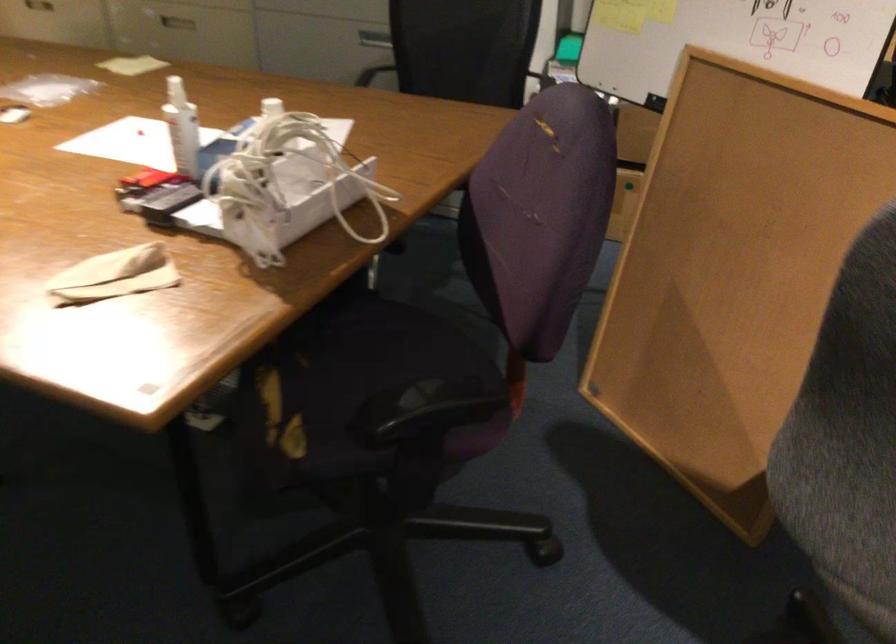
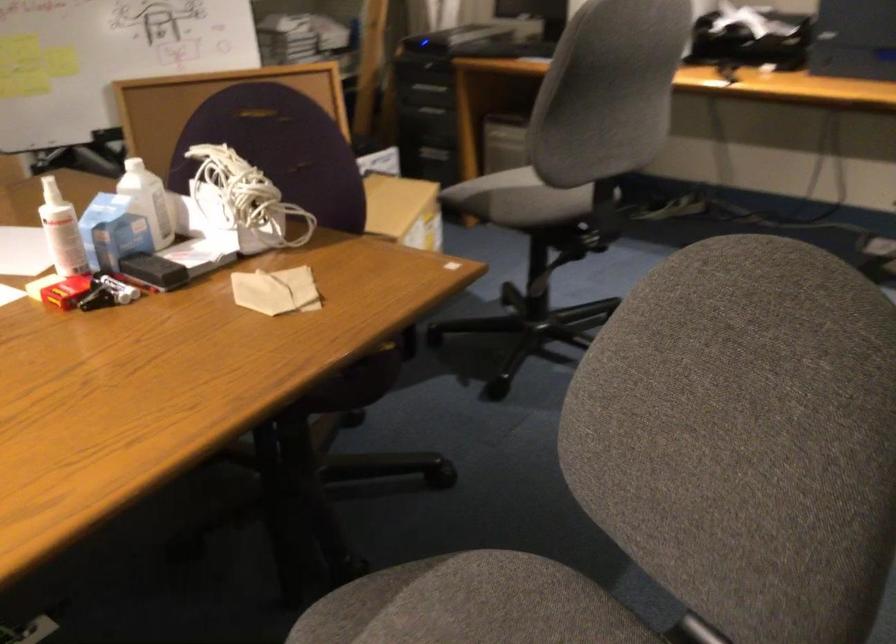
Where in the second image is the point corresponding to the point at 122,274 from the first image?

(276, 290)